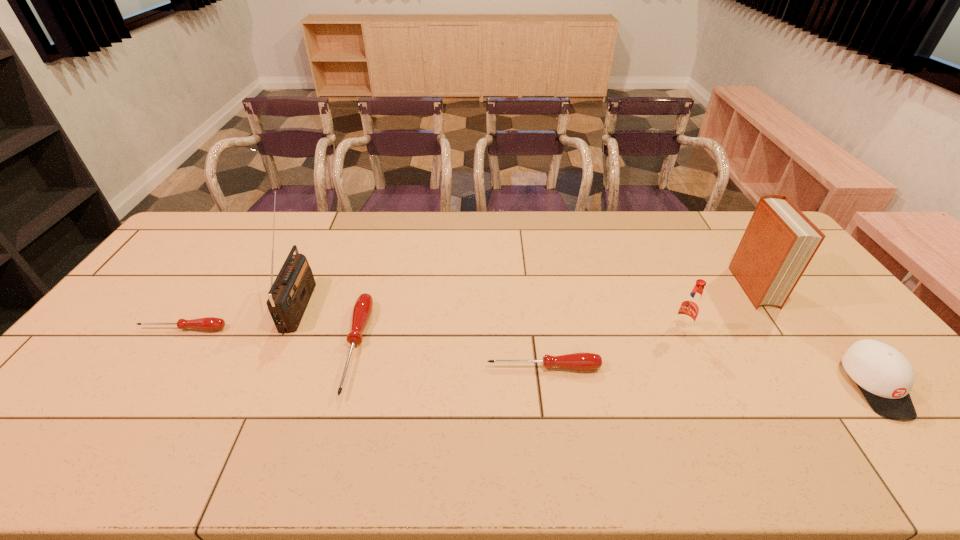
Identify the location of vacant area between the fifth object from right to left and the sixth object from left to right. Image resolution: width=960 pixels, height=540 pixels. coord(554,317).

Identify the location of free space that is in between the leftmost screwdriver and the rightmost screwdriver. The width and height of the screenshot is (960, 540). 364,348.

This screenshot has height=540, width=960. Identify the location of vacant space that is in between the baseball cap and the third object from left to right. (615, 367).

The width and height of the screenshot is (960, 540). What are the coordinates of `vacant area that lies between the second object from right to left and the fifth object from left to right` in the screenshot? It's located at (717, 308).

At what (x,y) coordinates should I click in order to perform the action: click on free spot between the hardback book and the rightmost screwdriver. Please return your answer as a coordinate pair (x, y). Looking at the image, I should click on (648, 327).

Find the location of `blank region between the root beer and the rightmost object`. blank region between the root beer and the rightmost object is located at coordinates (778, 357).

Where is `free spot between the third object from left to right and the shortest object`? The width and height of the screenshot is (960, 540). free spot between the third object from left to right and the shortest object is located at coordinates (270, 338).

The width and height of the screenshot is (960, 540). Identify the location of free spot between the hardback book and the leftmost object. (468, 308).

Where is `object that is the fifth closest to the rightmost object`? object that is the fifth closest to the rightmost object is located at coordinates (290, 293).

Find the location of a particular element. The width and height of the screenshot is (960, 540). object that ranks as the fourth closest to the fifth shortest object is located at coordinates (362, 309).